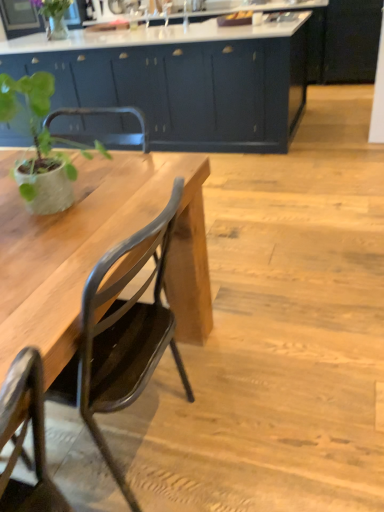
Question: Is green matte plant at left outside of matte black chair at left?

Choices:
 (A) yes
 (B) no

Answer: (A)

Question: Is green matte plant at left at the right side of matte black chair at left?

Choices:
 (A) no
 (B) yes

Answer: (A)

Question: Does green matte plant at left have a lesser height compared to matte black chair at left?

Choices:
 (A) yes
 (B) no

Answer: (A)

Question: Considering the relative positions of green matte plant at left and matte black chair at left in the image provided, is green matte plant at left to the left of matte black chair at left from the viewer's perspective?

Choices:
 (A) yes
 (B) no

Answer: (A)

Question: Is matte black chair at left at the back of green matte plant at left?

Choices:
 (A) no
 (B) yes

Answer: (A)

Question: From the image's perspective, is green matte plant at left beneath matte black chair at left?

Choices:
 (A) yes
 (B) no

Answer: (B)

Question: Does green matte vase at upper left appear on the left side of green matte plant at left?

Choices:
 (A) no
 (B) yes

Answer: (B)

Question: Is green matte vase at upper left positioned in front of green matte plant at left?

Choices:
 (A) no
 (B) yes

Answer: (A)

Question: From the image's perspective, does green matte vase at upper left appear higher than green matte plant at left?

Choices:
 (A) no
 (B) yes

Answer: (B)

Question: From the image's perspective, would you say green matte vase at upper left is shown under green matte plant at left?

Choices:
 (A) no
 (B) yes

Answer: (A)

Question: Can you confirm if green matte vase at upper left is shorter than green matte plant at left?

Choices:
 (A) no
 (B) yes

Answer: (B)

Question: Is green matte plant at left located within green matte vase at upper left?

Choices:
 (A) yes
 (B) no

Answer: (B)

Question: Considering the relative sizes of matte black chair at left and green matte plant at left in the image provided, is matte black chair at left shorter than green matte plant at left?

Choices:
 (A) yes
 (B) no

Answer: (B)